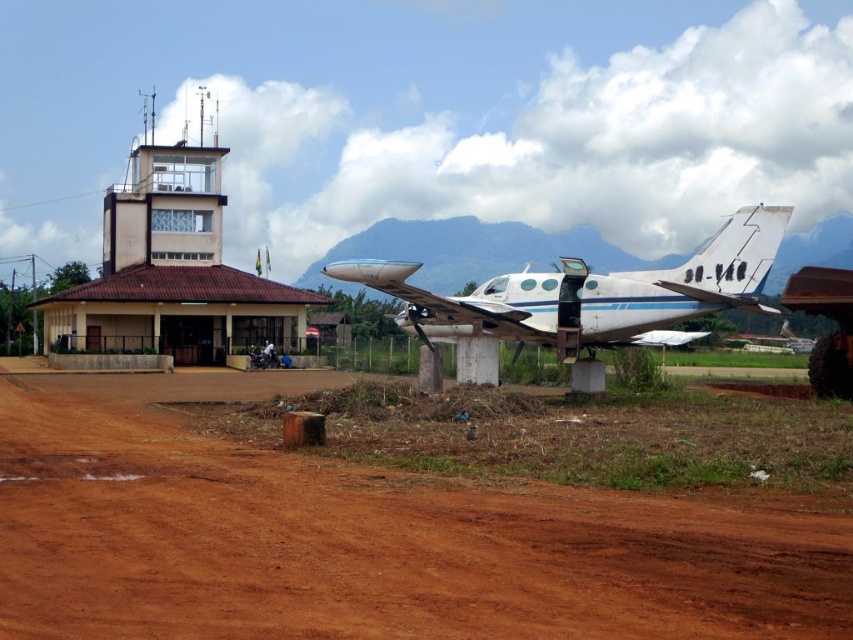
You are a pilot trying to land your small aircraft at this airport. The runway is the brown dirt field at lower center. Considering the description, will your plane, the white matte airplane at center, fit on the runway?

The brown dirt field at lower center is thinner than the white matte airplane at center, so the plane will not fit on the runway.

You are a pilot who needs to taxi your plane from the white matte airplane at center to the runway located at the brown dirt field at lower center. Can your plane reach the runway without any obstacles?

The brown dirt field at lower center is 37.89 feet from the white matte airplane at center. Since the distance is relatively short and there are no mentioned obstacles, the plane can likely reach the runway without issues.

You are standing at the point marked as point (364,538) in the image. What type of terrain are you currently standing on?

Result: The point (364,538) corresponds to the brown dirt field at lower center, so you are standing on dirt terrain.